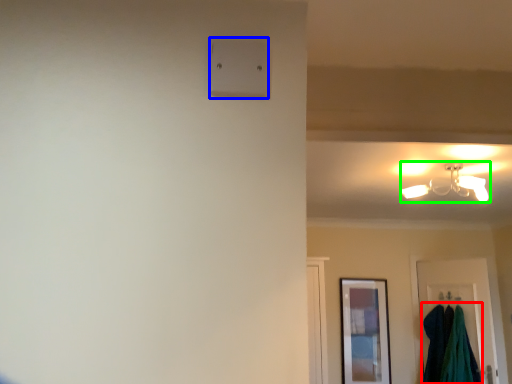
Question: Which object is the closest to the laundry (highlighted by a red box)? Choose among these: light switch (highlighted by a blue box) or lamp (highlighted by a green box).

Choices:
 (A) light switch
 (B) lamp

Answer: (B)